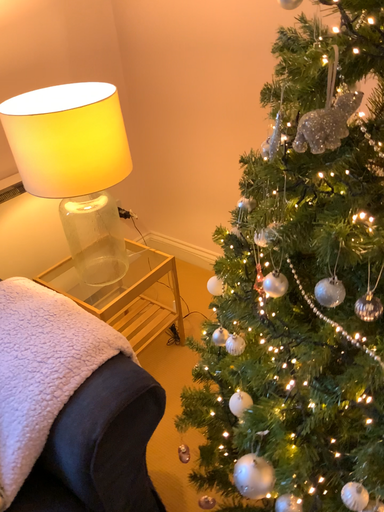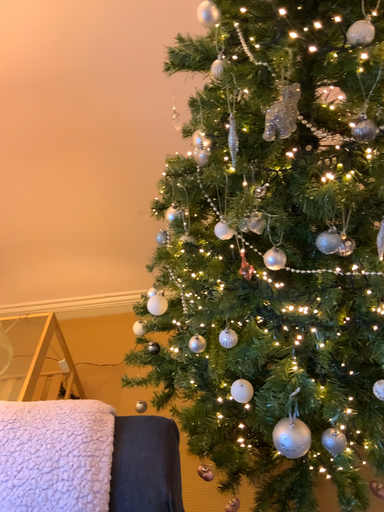
Question: How did the camera likely rotate when shooting the video?

Choices:
 (A) rotated left
 (B) rotated right

Answer: (B)